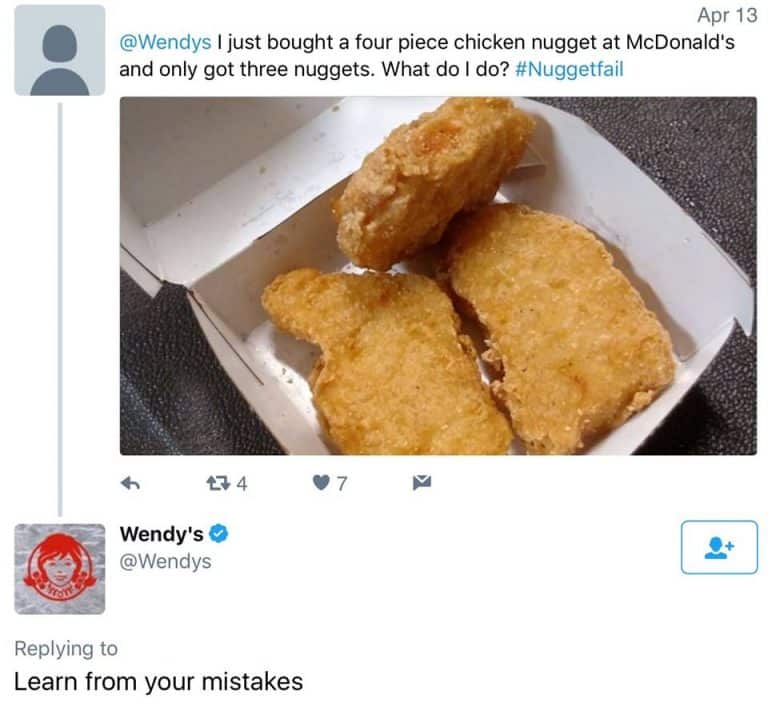
This screenshot has width=768, height=711. Find the location of `table`. table is located at coordinates (699, 144).